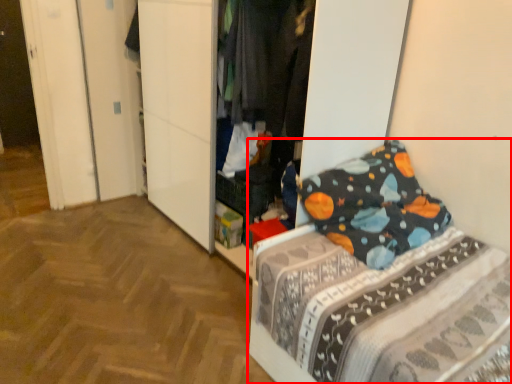
Question: From the image's perspective, what is the correct spatial positioning of bed (annotated by the red box) in reference to clothing?

Choices:
 (A) above
 (B) below

Answer: (B)